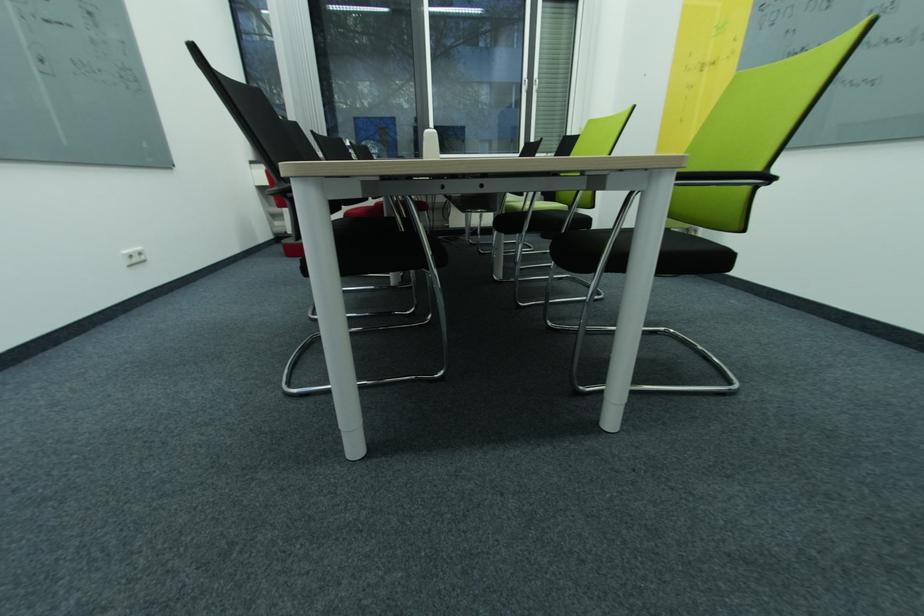
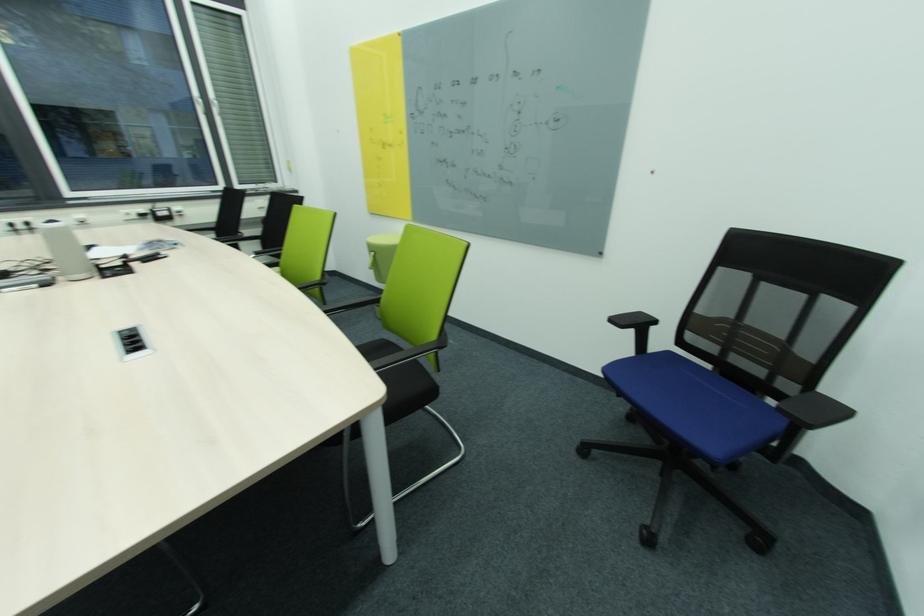
The point at (794, 493) is marked in the first image. Where is the corresponding point in the second image?

(503, 544)